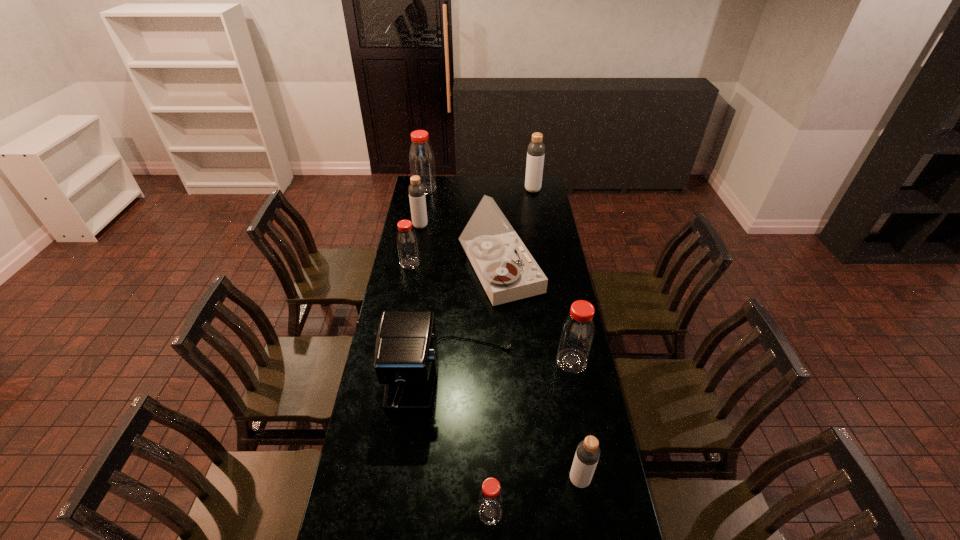
The image size is (960, 540). I want to click on empty space that is in between the farthest gray bottle and the fifth nearest bottle, so click(476, 208).

Identify the location of free spot between the biggest red bottle and the black coffee maker. point(437,284).

Image resolution: width=960 pixels, height=540 pixels. I want to click on vacant space that's between the fifth nearest bottle and the biggest gray bottle, so click(x=476, y=208).

What are the coordinates of `vacant region between the sixth farthest bottle and the farthest red bottle` in the screenshot? It's located at (502, 334).

Identify the location of empty location between the third nearest bottle and the second farthest red bottle. This screenshot has height=540, width=960. (491, 312).

Where is `object that ranks as the seventh closest to the black coffee maker`? This screenshot has height=540, width=960. object that ranks as the seventh closest to the black coffee maker is located at coordinates (421, 157).

I want to click on object that can be found as the fifth closest to the biggest gray bottle, so click(x=406, y=353).

Where is `bottle that is the sixth closest to the biggest gray bottle`? Image resolution: width=960 pixels, height=540 pixels. bottle that is the sixth closest to the biggest gray bottle is located at coordinates (490, 498).

Identify which bottle is located as the sixth nearest to the leftmost gray bottle. Please provide its 2D coordinates. Your answer should be formatted as a tuple, i.e. [(x, y)], where the tuple contains the x and y coordinates of a point satisfying the conditions above.

[(490, 498)]

Where is `red bottle object that ranks as the second closest to the smallest red bottle`? This screenshot has width=960, height=540. red bottle object that ranks as the second closest to the smallest red bottle is located at coordinates (407, 245).